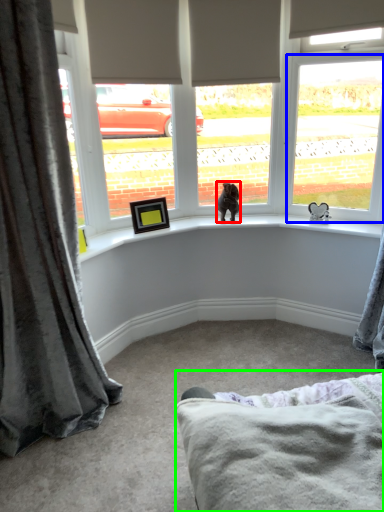
Question: Considering the real-world distances, which object is farthest from animal (highlighted by a red box)? window (highlighted by a blue box) or bedding (highlighted by a green box)?

Choices:
 (A) window
 (B) bedding

Answer: (B)